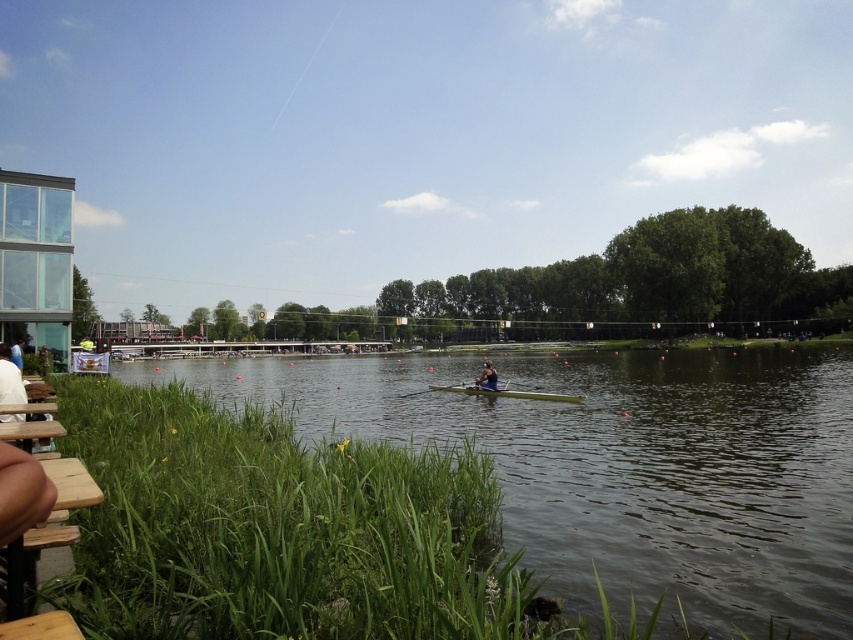
Question: Is white fabric at lower left behind blue fabric rower at center?

Choices:
 (A) yes
 (B) no

Answer: (B)

Question: Can you confirm if green smooth canoe at center is positioned to the left of blue fabric rower at center?

Choices:
 (A) yes
 (B) no

Answer: (B)

Question: Which point is closer to the camera taking this photo?

Choices:
 (A) (16, 378)
 (B) (480, 372)

Answer: (A)

Question: Which point is farther from the camera taking this photo?

Choices:
 (A) (496, 387)
 (B) (18, 369)
 (C) (505, 452)
 (D) (461, 387)

Answer: (D)

Question: Which object is the closest to the green smooth canoe at center?

Choices:
 (A) green grassy river at center
 (B) white fabric at lower left
 (C) blue fabric rower at center

Answer: (C)

Question: Does green grassy river at center have a greater width compared to white fabric at lower left?

Choices:
 (A) yes
 (B) no

Answer: (A)